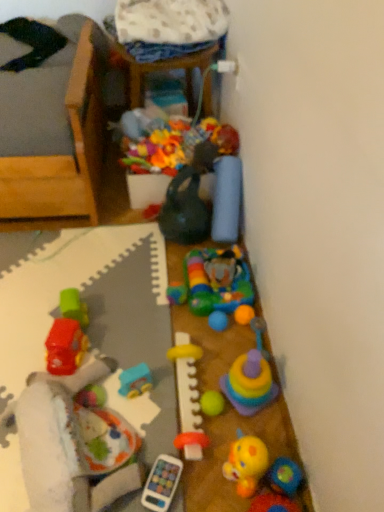
Where is `blank space to the left of rubber duck at center, the fifth toy from the right`? Image resolution: width=384 pixels, height=512 pixels. blank space to the left of rubber duck at center, the fifth toy from the right is located at coordinates (186, 457).